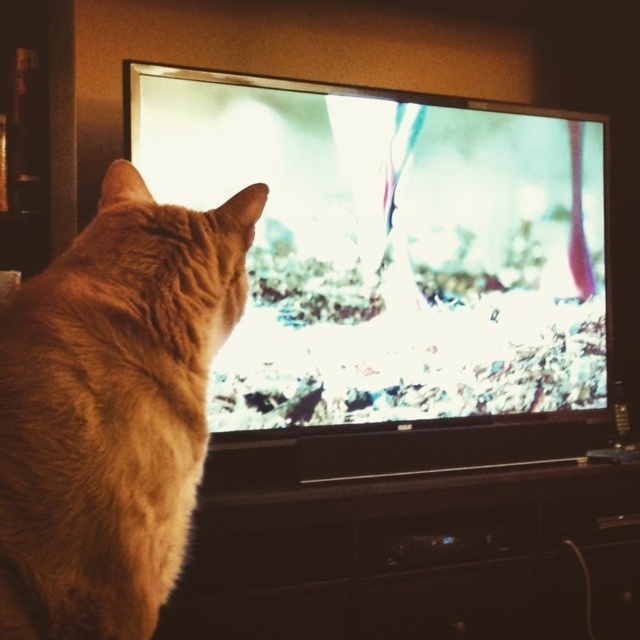
You are navigating a small drone through the living room where the ginger cat is watching TV. The drone must fly from point A at point (x=132, y=65) to point B at point (x=294, y=545) without hitting any obstacles. According to the scene description, is there a clear path between these two points?

Point (x=132, y=65) is in front of point (x=294, y=545), so the path between them is unobstructed as there are no objects mentioned between them in the scene description.

You are a photographer trying to capture the orange fur cat at left in a photo. The matte screen at center is reflecting too much light, making it hard to focus. To avoid the reflection, should you move to the right or left of the cat?

To avoid the reflection from the matte screen at center, you should move to the left of the orange fur cat at left. Since the matte screen at center is above the cat, moving to the left side of the cat would position you away from the screen, reducing the reflection interference.

You are a cat owner who wants to ensure your cat is comfortable. Your cat is sitting at point (394, 268). The television screen is at center. Is the cat facing the television screen?

The point (394, 268) is on the matte screen at center, so the cat is facing the television screen.